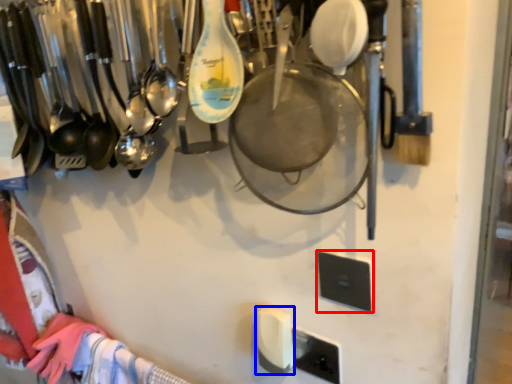
Question: Which object appears farthest to the camera in this image, light switch (highlighted by a red box) or light switch (highlighted by a blue box)?

Choices:
 (A) light switch
 (B) light switch

Answer: (B)